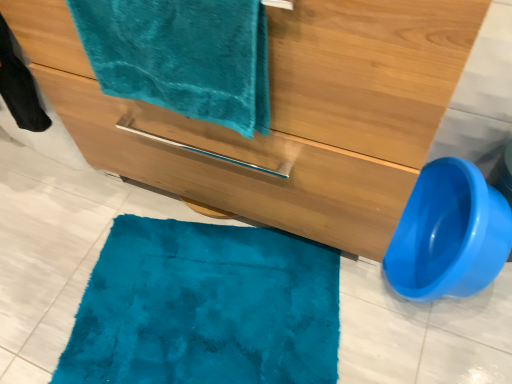
Question: Does blue plastic toilet bowl at lower right lie in front of teal plush towel at upper left?

Choices:
 (A) yes
 (B) no

Answer: (B)

Question: Considering the relative sizes of blue plastic toilet bowl at lower right and teal plush towel at upper left in the image provided, is blue plastic toilet bowl at lower right taller than teal plush towel at upper left?

Choices:
 (A) yes
 (B) no

Answer: (A)

Question: Is blue plastic toilet bowl at lower right outside of teal plush towel at upper left?

Choices:
 (A) yes
 (B) no

Answer: (A)

Question: From the image's perspective, is blue plastic toilet bowl at lower right located above teal plush towel at upper left?

Choices:
 (A) yes
 (B) no

Answer: (B)

Question: Considering the relative sizes of blue plastic toilet bowl at lower right and teal plush towel at upper left in the image provided, is blue plastic toilet bowl at lower right shorter than teal plush towel at upper left?

Choices:
 (A) no
 (B) yes

Answer: (A)

Question: In the image, is teal plush towel at upper left on the left side or the right side of blue plastic toilet bowl at lower right?

Choices:
 (A) right
 (B) left

Answer: (B)

Question: From a real-world perspective, is teal plush towel at upper left physically located above or below blue plastic toilet bowl at lower right?

Choices:
 (A) below
 (B) above

Answer: (B)

Question: Considering the positions of teal plush towel at upper left and blue plastic toilet bowl at lower right in the image, is teal plush towel at upper left wider or thinner than blue plastic toilet bowl at lower right?

Choices:
 (A) wide
 (B) thin

Answer: (B)

Question: Considering the positions of teal plush towel at upper left and blue plastic toilet bowl at lower right in the image, is teal plush towel at upper left bigger or smaller than blue plastic toilet bowl at lower right?

Choices:
 (A) big
 (B) small

Answer: (B)

Question: Visually, is teal plush towel at upper left positioned to the left or to the right of matte wood bathroom cabinet at center?

Choices:
 (A) right
 (B) left

Answer: (B)

Question: Is teal plush towel at upper left bigger or smaller than matte wood bathroom cabinet at center?

Choices:
 (A) big
 (B) small

Answer: (B)

Question: Is point (224, 57) positioned closer to the camera than point (146, 173)?

Choices:
 (A) farther
 (B) closer

Answer: (B)

Question: In terms of width, does teal plush towel at upper left look wider or thinner when compared to matte wood bathroom cabinet at center?

Choices:
 (A) thin
 (B) wide

Answer: (A)

Question: From their relative heights in the image, would you say blue plastic toilet bowl at lower right is taller or shorter than matte wood bathroom cabinet at center?

Choices:
 (A) short
 (B) tall

Answer: (A)

Question: Is blue plastic toilet bowl at lower right to the left or to the right of matte wood bathroom cabinet at center in the image?

Choices:
 (A) left
 (B) right

Answer: (B)